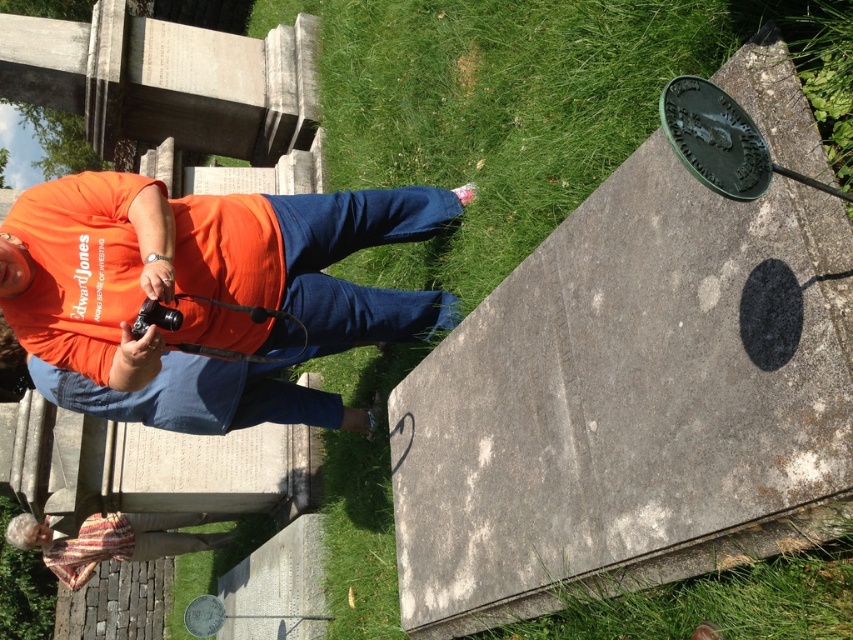
You are a photographer at the cemetery scene. You notice the orange cotton shirt at center and the striped fabric at lower left. Which object is taller?

The orange cotton shirt at center is taller than the striped fabric at lower left.

You are a photographer standing in a cemetery. You notice the gray stone marker at upper right and the orange cotton shirt at center. Which object is taller?

The gray stone marker at upper right is taller than the orange cotton shirt at center.